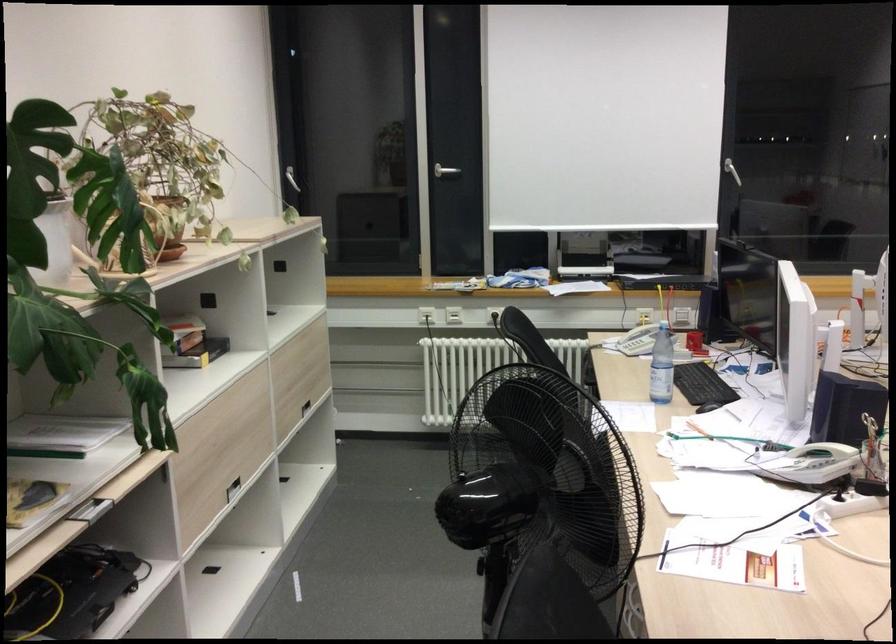
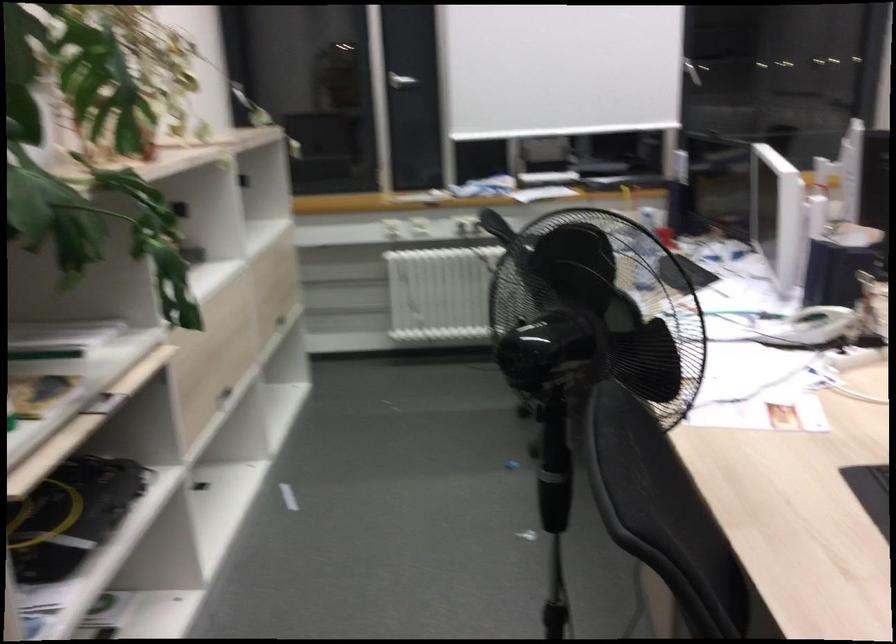
The point at (816, 469) is marked in the first image. Where is the corresponding point in the second image?

(811, 327)